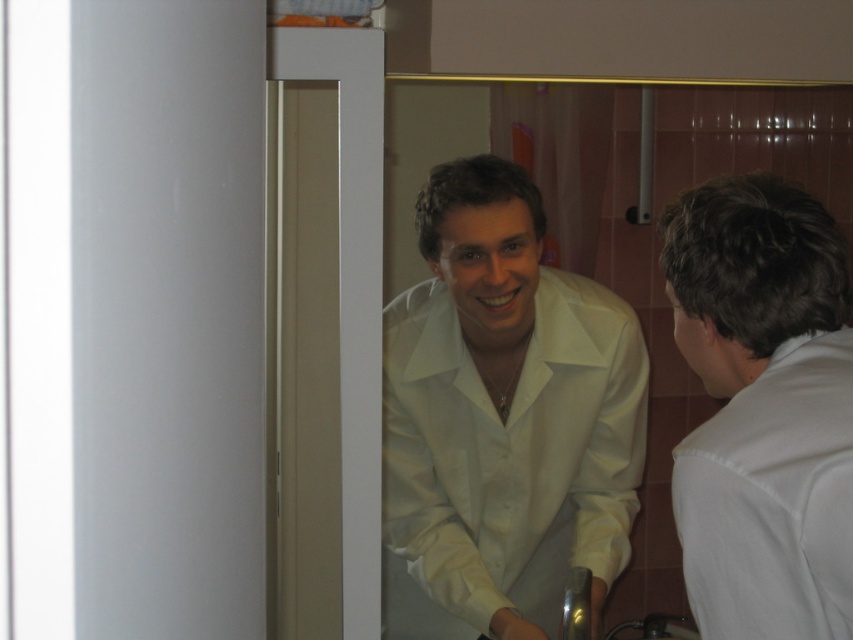
You are a tailor measuring shirts for a customer. The customer wants to know if the white glossy shirt at center and the white matte shirt at right can be placed side by side on a 20 inch wide shelf. Can they fit?

The distance between the white glossy shirt at center and the white matte shirt at right is 19.10 inches, so they can fit side by side on a 20 inch wide shelf since 19.10 is less than 20 inches.

You are organizing a closet and need to arrange the white glossy shirt at center and the white matte shirt at right based on their positions. Which shirt is located to the left of the other?

The white glossy shirt at center is positioned on the left side of white matte shirt at right, so the white glossy shirt at center is to the left of the white matte shirt at right.

You are a designer trying to place a decorative sticker on the white glossy shirt at center. The sticker needs to be placed at coordinates point 0.656, 0.590. Is this the best location for visibility?

The white glossy shirt at center is located at point (502,419), so placing the sticker there would be ideal for visibility as it is centered on the shirt.